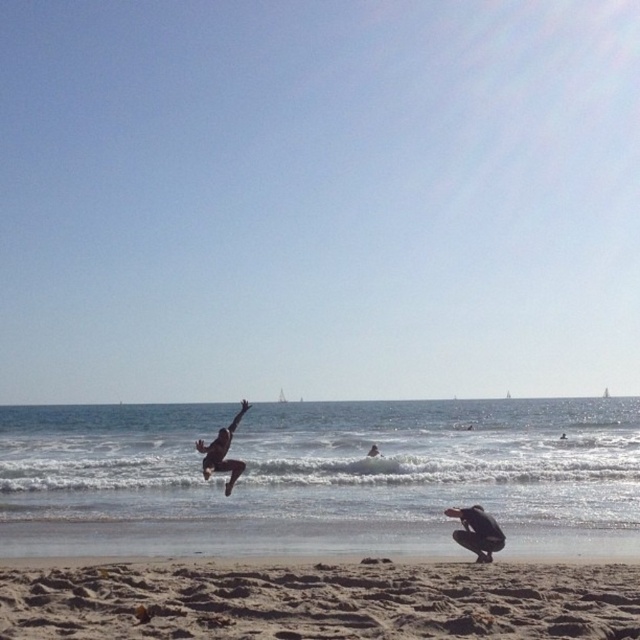
How far apart are black matte person at lower right and silhouette figure at center?

A distance of 68.13 feet exists between black matte person at lower right and silhouette figure at center.

Between point (470, 534) and point (369, 456), which one is positioned in front?

Point (470, 534) is more forward.

Where is `black matte person at lower right`? This screenshot has height=640, width=640. black matte person at lower right is located at coordinates (476, 531).

Who is lower down, sandy beach at lower center or silhouette figure at center?

silhouette figure at center is lower down.

Is sandy beach at lower center taller than silhouette figure at center?

In fact, sandy beach at lower center may be shorter than silhouette figure at center.

Between point (378, 589) and point (376, 451), which one is positioned behind?

Positioned behind is point (376, 451).

Where is `sandy beach at lower center`? This screenshot has height=640, width=640. sandy beach at lower center is located at coordinates click(x=321, y=602).

What are the coordinates of `sandy beach at lower center` in the screenshot? It's located at (321, 602).